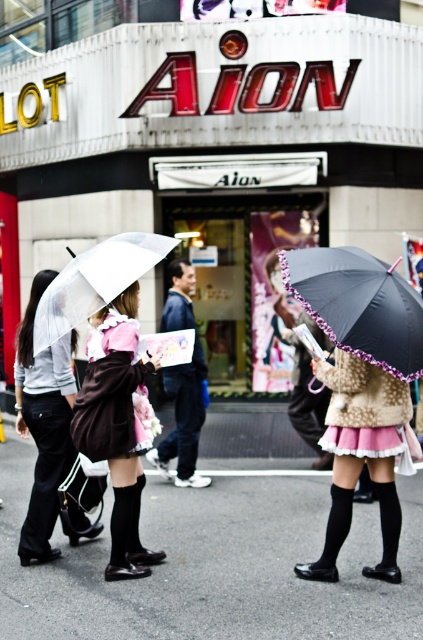
Is matte pink dress at center above velvet pink dress at center?

No, matte pink dress at center is not above velvet pink dress at center.

This screenshot has width=423, height=640. What are the coordinates of `matte pink dress at center` in the screenshot? It's located at (118, 426).

Who is more forward, (120, 449) or (95, 260)?

Positioned in front is point (120, 449).

Between matte pink dress at center and transparent plastic umbrella at center, which one is positioned higher?

Positioned higher is transparent plastic umbrella at center.

At what (x,y) coordinates should I click in order to perform the action: click on matte pink dress at center. Please return your answer as a coordinate pair (x, y). Looking at the image, I should click on (118, 426).

Who is positioned more to the left, matte pink skirt at center or pink satin skirt at center?

pink satin skirt at center

The width and height of the screenshot is (423, 640). Describe the element at coordinates (360, 456) in the screenshot. I see `matte pink skirt at center` at that location.

This screenshot has width=423, height=640. I want to click on matte pink skirt at center, so click(x=360, y=456).